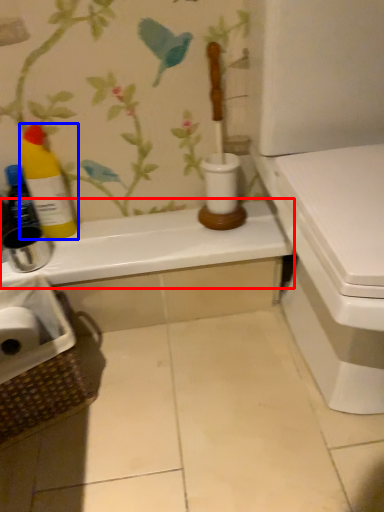
Question: Which point is further to the camera, counter top (highlighted by a red box) or bottle (highlighted by a blue box)?

Choices:
 (A) counter top
 (B) bottle

Answer: (A)